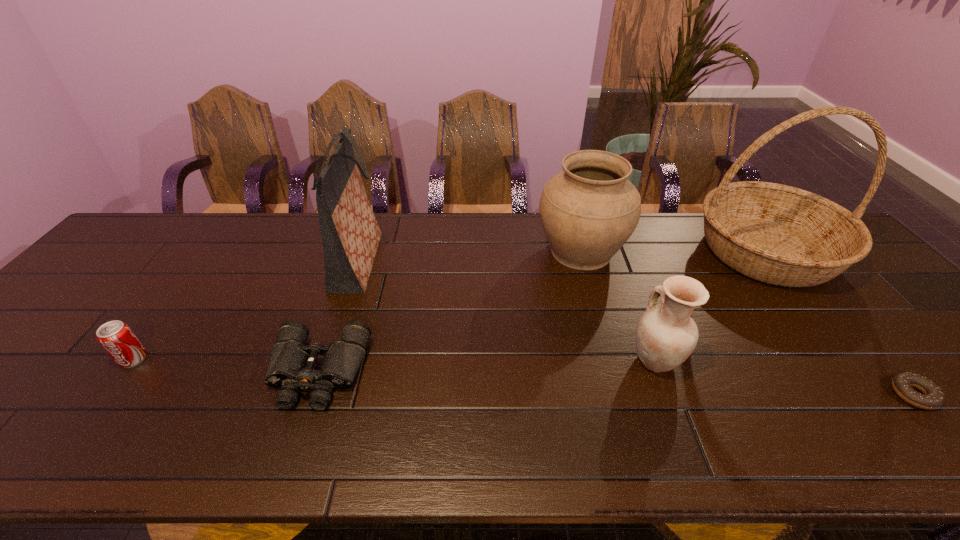
Find the location of a particular element. This screenshot has width=960, height=540. free space between the second shortest object and the shortest object is located at coordinates (615, 383).

This screenshot has height=540, width=960. In order to click on blank region between the basket and the shortest object in this screenshot , I will do `click(839, 323)`.

At what (x,y) coordinates should I click in order to perform the action: click on vacant space that's between the second shortest object and the second tallest object. Please return your answer as a coordinate pair (x, y). Looking at the image, I should click on (339, 317).

Identify the location of object that is the sixth closest to the urn. Image resolution: width=960 pixels, height=540 pixels. (116, 337).

Find the location of a particular element. This screenshot has height=540, width=960. object that is the fourth closest to the urn is located at coordinates (291, 365).

What are the coordinates of `vacant space that satisfies the following two spatial constraints: 1. on the front-facing side of the shopping bag; 2. on the right side of the shortest object` in the screenshot? It's located at (315, 395).

What are the coordinates of `vacant position in the image that satisfies the following two spatial constraints: 1. on the front-facing side of the pottery; 2. on the right side of the second tallest object` in the screenshot? It's located at (326, 360).

The width and height of the screenshot is (960, 540). Identify the location of vacant region that satisfies the following two spatial constraints: 1. on the front-facing side of the doughnut; 2. on the right side of the shopping bag. (315, 395).